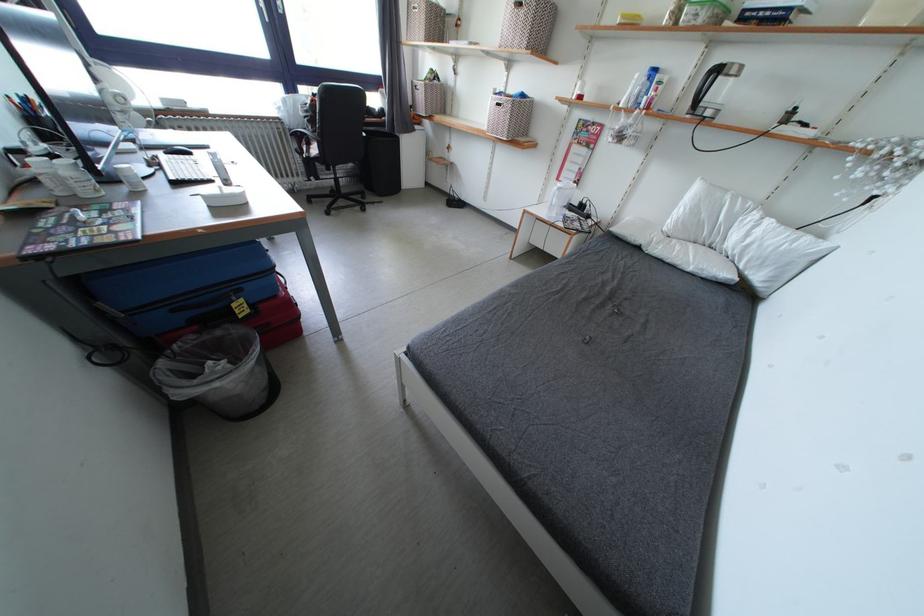
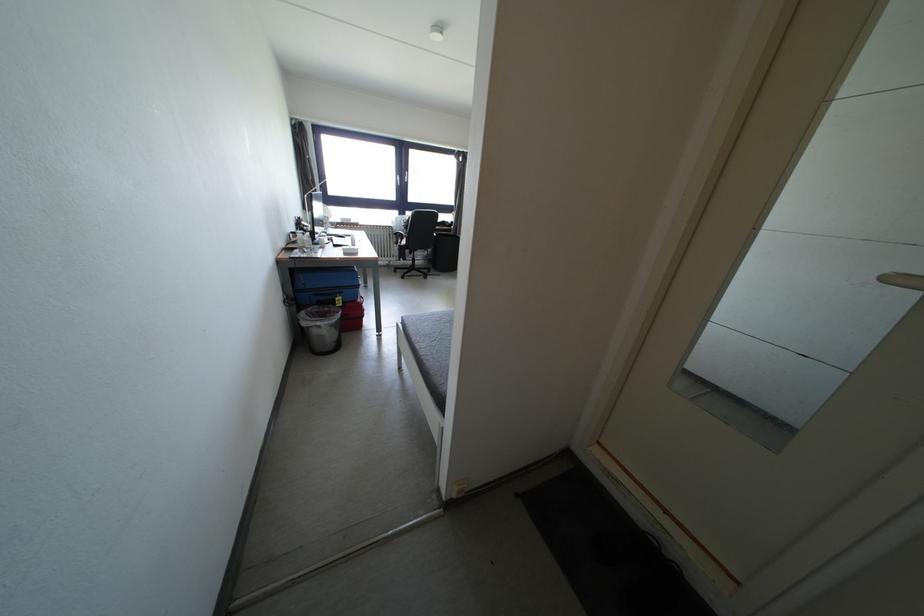
In the second image, find the point that corresponds to (240,310) in the first image.

(344, 302)